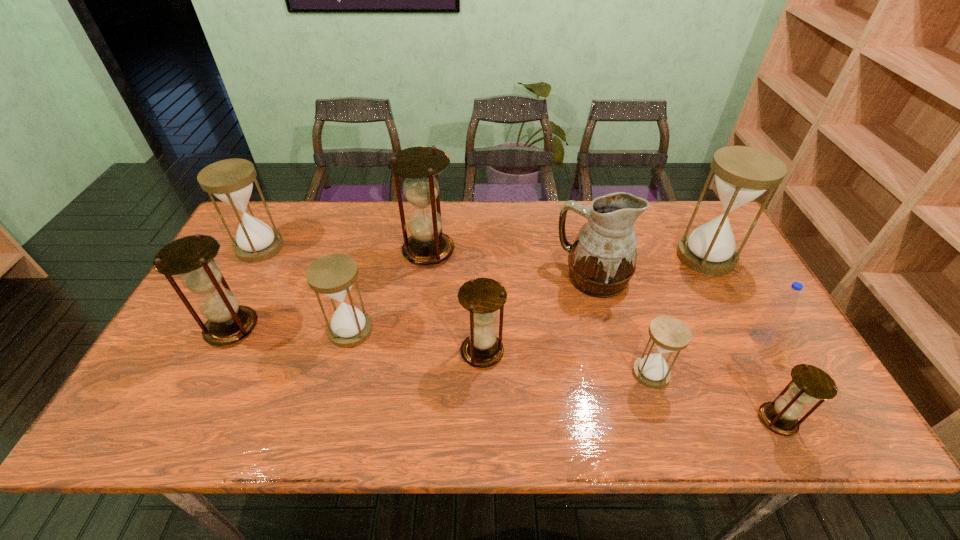
Choose which white hourglass is the third nearest neighbor to the third brown hourglass from left to right. Please provide its 2D coordinates. Your answer should be formatted as a tuple, i.e. [(x, y)], where the tuple contains the x and y coordinates of a point satisfying the conditions above.

[(742, 174)]

Identify the location of free space in the image that satisfies the following two spatial constraints: 1. on the front side of the third brown hourglass from right to left; 2. on the right side of the water bottle. The width and height of the screenshot is (960, 540). (418, 338).